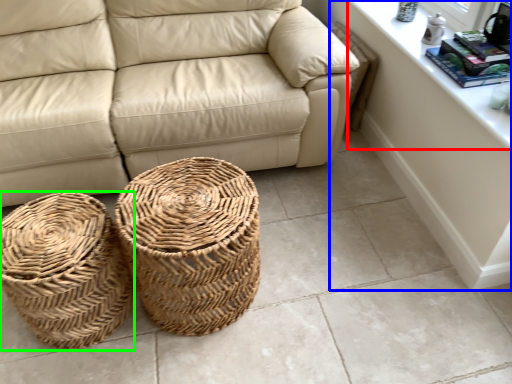
Question: Which is farther away from window sill (highlighted by a red box)? dresser (highlighted by a blue box) or basket (highlighted by a green box)?

Choices:
 (A) dresser
 (B) basket

Answer: (B)